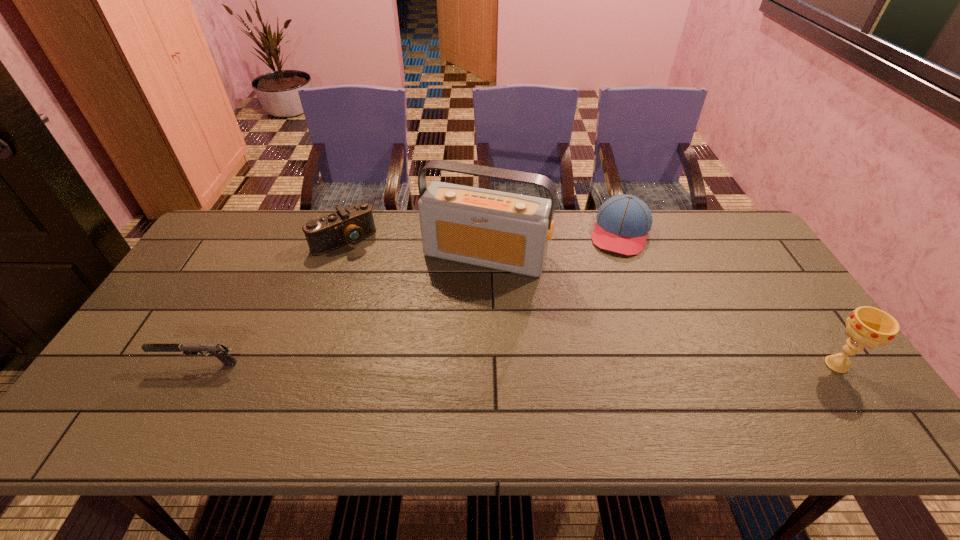
In order to click on the closest object to the camera in this screenshot , I will do `click(505, 231)`.